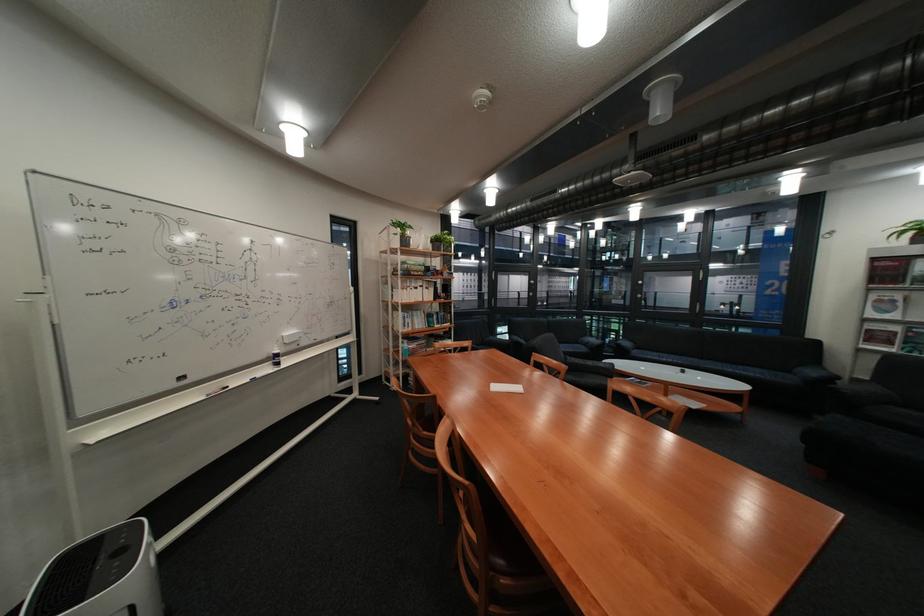
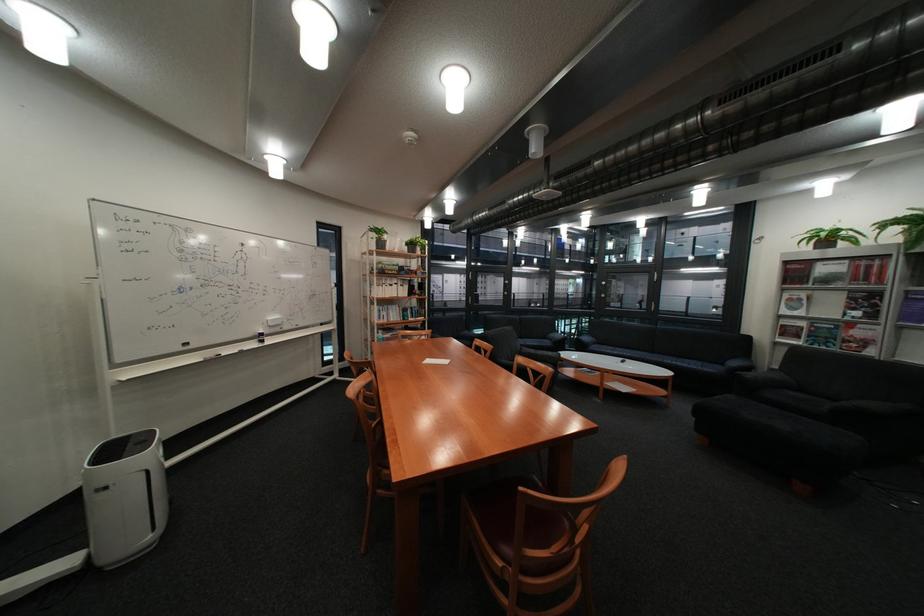
Where in the second image is the point corresponding to [805,371] from the first image?

(737, 363)